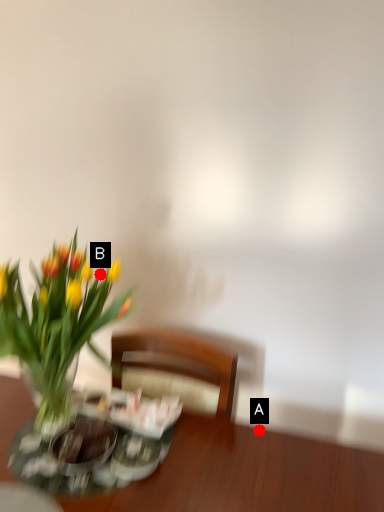
Question: Two points are circled on the image, labeled by A and B beside each circle. Which of the following is the closest to the observer?

Choices:
 (A) A is closer
 (B) B is closer

Answer: (A)